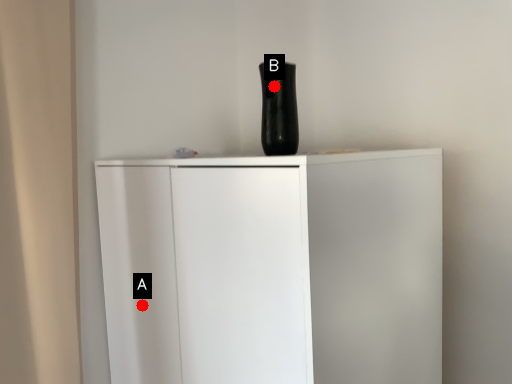
Question: Two points are circled on the image, labeled by A and B beside each circle. Which point is farther from the camera taking this photo?

Choices:
 (A) A is further
 (B) B is further

Answer: (A)